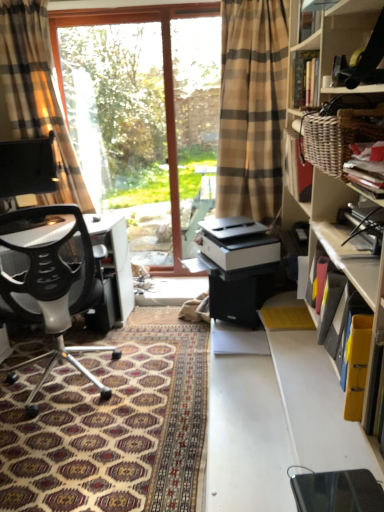
In order to face patterned carpet at lower left, should I rotate leftwards or rightwards?

Turn left approximately 14.045 degrees to face it.

Measure the distance between black mesh office chair at left and camera.

1.93 meters.

Locate an element on the screen. transparent glass window at center is located at coordinates (163, 70).

Would you say black mesh office chair at left is a long distance from plaid fabric curtain at left?

Yes, black mesh office chair at left is far from plaid fabric curtain at left.

Which of these two, black mesh office chair at left or plaid fabric curtain at left, is thinner?

plaid fabric curtain at left.

Is black mesh office chair at left aimed at plaid fabric curtain at left?

Yes.

From the image's perspective, is black mesh office chair at left above or below plaid fabric curtain at left?

black mesh office chair at left is below plaid fabric curtain at left.

From a real-world perspective, is transparent glass window at center positioned above or below yellow plastic folder at right, which is the 1th book from bottom to top?

transparent glass window at center is above yellow plastic folder at right, which is the 1th book from bottom to top.

Considering the relative sizes of transparent glass window at center and yellow plastic folder at right, acting as the 3th book starting from the top, in the image provided, is transparent glass window at center bigger than yellow plastic folder at right, acting as the 3th book starting from the top,?

Yes.

Is yellow plastic folder at right, which is the 1th book from bottom to top, a part of transparent glass window at center?

That's incorrect, yellow plastic folder at right, which is the 1th book from bottom to top, is not inside transparent glass window at center.

From a real-world perspective, which is physically below, transparent glass screen door at center or transparent glass window at center?

transparent glass window at center, from a real-world perspective.

Based on the photo, can you see transparent glass screen door at center touching transparent glass window at center?

transparent glass screen door at center and transparent glass window at center are clearly separated.

Can you confirm if transparent glass screen door at center is taller than transparent glass window at center?

In fact, transparent glass screen door at center may be shorter than transparent glass window at center.

Does plaid fabric curtain at left have a lesser width compared to yellow paper at upper right, the 1th book when ordered from top to bottom?

No.

In the image, is plaid fabric curtain at left positioned in front of or behind yellow paper at upper right, which is the third book from bottom to top?

In the image, plaid fabric curtain at left appears behind yellow paper at upper right, which is the third book from bottom to top.

Is the surface of plaid fabric curtain at left in direct contact with yellow paper at upper right, the 1th book when ordered from top to bottom?

plaid fabric curtain at left is not next to yellow paper at upper right, the 1th book when ordered from top to bottom, and they're not touching.

Based on the photo, is plaid fabric curtain at left bigger than yellow paper at upper right, the 1th book when ordered from top to bottom?

Yes.

Which of these two, matte black book at upper right, which is counted as the 2th book, starting from the bottom, or patterned carpet at lower left, is wider?

Wider between the two is patterned carpet at lower left.

Can you confirm if matte black book at upper right, the 2th book when ordered from top to bottom, is smaller than patterned carpet at lower left?

Indeed, matte black book at upper right, the 2th book when ordered from top to bottom, has a smaller size compared to patterned carpet at lower left.

Between matte black book at upper right, which is counted as the 2th book, starting from the bottom, and patterned carpet at lower left, which one has less height?

Standing shorter between the two is matte black book at upper right, which is counted as the 2th book, starting from the bottom.

Considering the positions of objects yellow plastic folder at right, acting as the 3th book starting from the top, and black mesh office chair at left in the image provided, who is more to the left, yellow plastic folder at right, acting as the 3th book starting from the top, or black mesh office chair at left?

From the viewer's perspective, black mesh office chair at left appears more on the left side.

Is yellow plastic folder at right, which is the 1th book from bottom to top, in contact with black mesh office chair at left?

yellow plastic folder at right, which is the 1th book from bottom to top, and black mesh office chair at left are clearly separated.

Which of these two, yellow plastic folder at right, acting as the 3th book starting from the top, or black mesh office chair at left, is thinner?

With smaller width is yellow plastic folder at right, acting as the 3th book starting from the top.

Is transparent glass window at center facing away from plaid fabric curtain at left?

No, plaid fabric curtain at left is not at the back of transparent glass window at center.

Considering the positions of point (171, 117) and point (36, 55), is point (171, 117) closer or farther from the camera than point (36, 55)?

Point (171, 117) is positioned farther from the camera compared to point (36, 55).

From the image's perspective, does transparent glass window at center appear higher than plaid fabric curtain at left?

Incorrect, from the image's perspective, transparent glass window at center is lower than plaid fabric curtain at left.

From a real-world perspective, relative to plaid fabric curtain at left, is transparent glass window at center vertically above or below?

In terms of real-world spatial position, transparent glass window at center is below plaid fabric curtain at left.

Where is `chair on the right of plaid fabric curtain at left`? Image resolution: width=384 pixels, height=512 pixels. chair on the right of plaid fabric curtain at left is located at coordinates (x=50, y=278).

Image resolution: width=384 pixels, height=512 pixels. What are the coordinates of `window behind the yellow plastic folder at right, acting as the 3th book starting from the top` in the screenshot? It's located at (163, 70).

Estimate the real-world distances between objects in this image. Which object is further from patterned carpet at lower left, transparent glass screen door at center or matte black book at upper right, which is counted as the 2th book, starting from the bottom?

Based on the image, transparent glass screen door at center appears to be further to patterned carpet at lower left.

When comparing their distances from plaid fabric curtain at left, does patterned carpet at lower left or transparent glass screen door at center seem closer?

patterned carpet at lower left.

From the image, which object appears to be farther from plaid fabric curtain at left, yellow paper at upper right, the 1th book when ordered from top to bottom, or transparent glass window at center?

Based on the image, yellow paper at upper right, the 1th book when ordered from top to bottom, appears to be further to plaid fabric curtain at left.

Looking at the image, which one is located closer to white matte printer at center, patterned carpet at lower left or yellow plastic folder at right, which is the 1th book from bottom to top?

patterned carpet at lower left.

Estimate the real-world distances between objects in this image. Which object is closer to white matte printer at center, transparent glass window at center or matte black book at upper right, the 2th book when ordered from top to bottom?

matte black book at upper right, the 2th book when ordered from top to bottom, is positioned closer to the anchor white matte printer at center.

When comparing their distances from matte black book at upper right, the 2th book when ordered from top to bottom, does transparent glass window at center or white matte printer at center seem further?

transparent glass window at center is positioned further to the anchor matte black book at upper right, the 2th book when ordered from top to bottom.

Estimate the real-world distances between objects in this image. Which object is closer to yellow plastic folder at right, which is the 1th book from bottom to top, yellow paper at upper right, which is the third book from bottom to top, or black mesh office chair at left?

yellow paper at upper right, which is the third book from bottom to top, is positioned closer to the anchor yellow plastic folder at right, which is the 1th book from bottom to top.

Based on their spatial positions, is transparent glass screen door at center or transparent glass window at center closer to yellow plastic folder at right, acting as the 3th book starting from the top?

The object closer to yellow plastic folder at right, acting as the 3th book starting from the top, is transparent glass window at center.

You are a GUI agent. You are given a task and a screenshot of the screen. Output one action in this format:
    pyautogui.click(x=<x>, y=<y>)
    Task: Click on the screen door between plaid fabric curtain at left and white matte printer at center from left to right
    
    Given the screenshot: What is the action you would take?
    pyautogui.click(x=196, y=117)

The height and width of the screenshot is (512, 384). Find the location of `printer located between yellow paper at upper right, the 1th book when ordered from top to bottom, and transparent glass screen door at center in the depth direction`. printer located between yellow paper at upper right, the 1th book when ordered from top to bottom, and transparent glass screen door at center in the depth direction is located at coordinates tap(237, 243).

Where is `printer positioned between black mesh office chair at left and transparent glass screen door at center from near to far`? printer positioned between black mesh office chair at left and transparent glass screen door at center from near to far is located at coordinates (237, 243).

What are the coordinates of `mat located between yellow paper at upper right, which is the third book from bottom to top, and transparent glass screen door at center in the depth direction` in the screenshot? It's located at (110, 428).